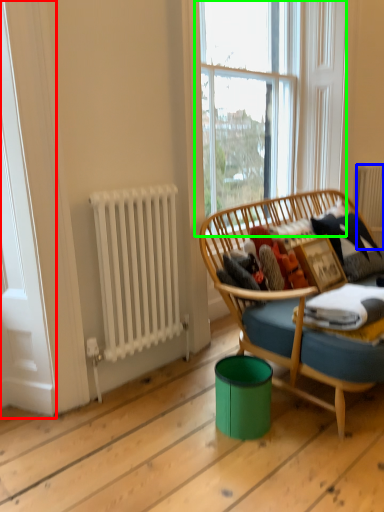
Question: Estimate the real-world distances between objects in this image. Which object is farther from screen door (highlighted by a red box), radiator (highlighted by a blue box) or window (highlighted by a green box)?

Choices:
 (A) radiator
 (B) window

Answer: (A)